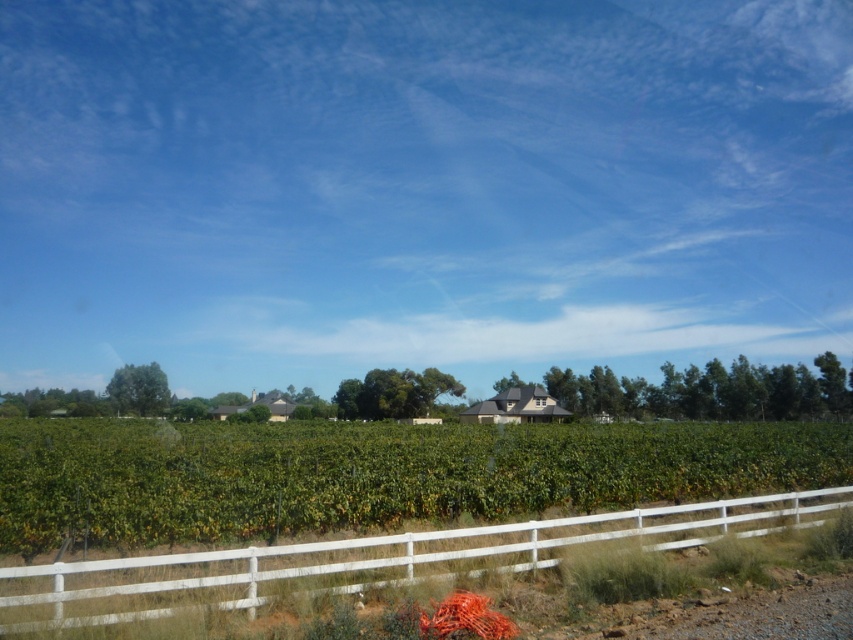
Question: Which object appears farthest from the camera in this image?

Choices:
 (A) green leafy vineyard at center
 (B) white wooden fence at lower center

Answer: (A)

Question: Among these points, which one is nearest to the camera?

Choices:
 (A) (704, 461)
 (B) (408, 572)

Answer: (B)

Question: Can you confirm if green leafy vineyard at center is positioned above white wooden fence at lower center?

Choices:
 (A) yes
 (B) no

Answer: (B)

Question: From the image, what is the correct spatial relationship of green leafy vineyard at center in relation to white wooden fence at lower center?

Choices:
 (A) below
 (B) above

Answer: (A)

Question: Is green leafy vineyard at center wider than white wooden fence at lower center?

Choices:
 (A) yes
 (B) no

Answer: (A)